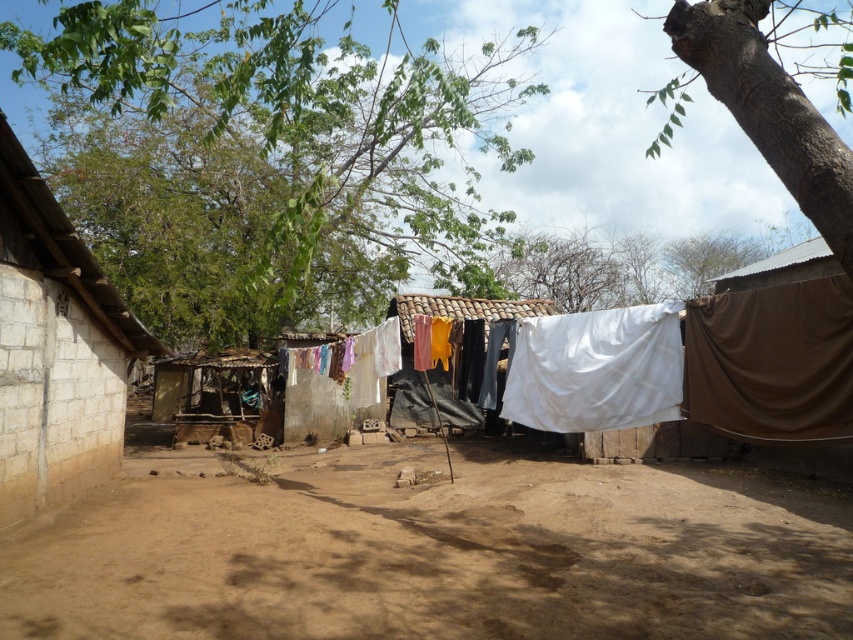
You are standing in the village scene and want to take a photo of both the light beige concrete hut at left and the brown rough bark tree at upper right. However, you notice that the tree is partially blocking the view of the hut. Which object should you move closer to in order to frame both in your photo?

The brown rough bark tree at upper right is behind the light beige concrete hut at left, so you should move closer to the light beige concrete hut at left to frame both objects in your photo.

You are standing in the rural village scene and want to take a photo of the light beige concrete hut at left without the green leafy tree at upper center blocking the view. Which direction should you move to ensure the tree is out of frame?

Move to the left side of the light beige concrete hut at left so that the green leafy tree at upper center is positioned to the right of the hut and out of the frame.

You are standing in the rural village scene and want to take a photo of the light beige concrete hut at left and the brown rough bark tree at upper right. Which object should you focus on first if you want to capture both in a single frame without moving the camera?

The light beige concrete hut at left is shorter than the brown rough bark tree at upper right, so you should focus on the brown rough bark tree at upper right first to ensure both are in frame.